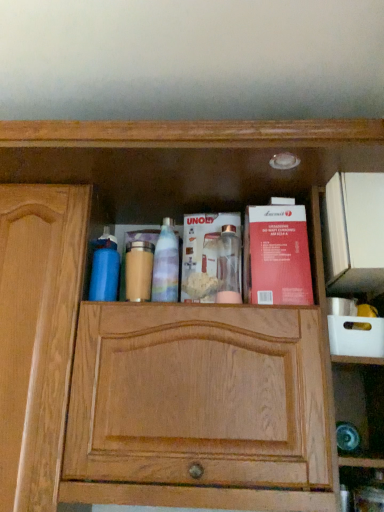
Question: Is matte gold jar at center completely or partially outside of translucent plastic spray bottle at center, which appears as the 2th cleaning product when viewed from the left?

Choices:
 (A) no
 (B) yes

Answer: (B)

Question: From a real-world perspective, is matte gold jar at center positioned over translucent plastic spray bottle at center, marked as the first cleaning product in a right-to-left arrangement, based on gravity?

Choices:
 (A) no
 (B) yes

Answer: (A)

Question: Would you say matte gold jar at center contains translucent plastic spray bottle at center, which appears as the 2th cleaning product when viewed from the left?

Choices:
 (A) yes
 (B) no

Answer: (B)

Question: Does matte gold jar at center come behind translucent plastic spray bottle at center, which appears as the 2th cleaning product when viewed from the left?

Choices:
 (A) yes
 (B) no

Answer: (A)

Question: Does matte gold jar at center turn towards translucent plastic spray bottle at center, which appears as the 2th cleaning product when viewed from the left?

Choices:
 (A) no
 (B) yes

Answer: (A)

Question: In terms of size, does translucent plastic spray bottle at center, marked as the first cleaning product in a right-to-left arrangement, appear bigger or smaller than blue matte water bottle at left, placed as the 2th cleaning product when sorted from right to left?

Choices:
 (A) small
 (B) big

Answer: (A)

Question: Is translucent plastic spray bottle at center, which appears as the 2th cleaning product when viewed from the left, inside or outside of blue matte water bottle at left, arranged as the 1th cleaning product when viewed from the left?

Choices:
 (A) inside
 (B) outside

Answer: (B)

Question: From their relative heights in the image, would you say translucent plastic spray bottle at center, marked as the first cleaning product in a right-to-left arrangement, is taller or shorter than blue matte water bottle at left, placed as the 2th cleaning product when sorted from right to left?

Choices:
 (A) short
 (B) tall

Answer: (B)

Question: From a real-world perspective, is translucent plastic spray bottle at center, which appears as the 2th cleaning product when viewed from the left, physically located above or below blue matte water bottle at left, placed as the 2th cleaning product when sorted from right to left?

Choices:
 (A) above
 (B) below

Answer: (A)

Question: Would you say translucent plastic spray bottle at center, which appears as the 2th cleaning product when viewed from the left, is to the left or to the right of matte gold jar at center in the picture?

Choices:
 (A) right
 (B) left

Answer: (A)

Question: Considering the positions of translucent plastic spray bottle at center, which appears as the 2th cleaning product when viewed from the left, and matte gold jar at center in the image, is translucent plastic spray bottle at center, which appears as the 2th cleaning product when viewed from the left, bigger or smaller than matte gold jar at center?

Choices:
 (A) big
 (B) small

Answer: (A)

Question: Choose the correct answer: Is translucent plastic spray bottle at center, which appears as the 2th cleaning product when viewed from the left, inside matte gold jar at center or outside it?

Choices:
 (A) outside
 (B) inside

Answer: (A)

Question: In terms of width, does translucent plastic spray bottle at center, marked as the first cleaning product in a right-to-left arrangement, look wider or thinner when compared to matte gold jar at center?

Choices:
 (A) wide
 (B) thin

Answer: (B)

Question: Is blue matte water bottle at left, arranged as the 1th cleaning product when viewed from the left, bigger or smaller than metallic silver blender at center, the 2th book from the right?

Choices:
 (A) small
 (B) big

Answer: (A)

Question: Is blue matte water bottle at left, placed as the 2th cleaning product when sorted from right to left, inside or outside of metallic silver blender at center, which appears as the first book when viewed from the left?

Choices:
 (A) outside
 (B) inside

Answer: (A)